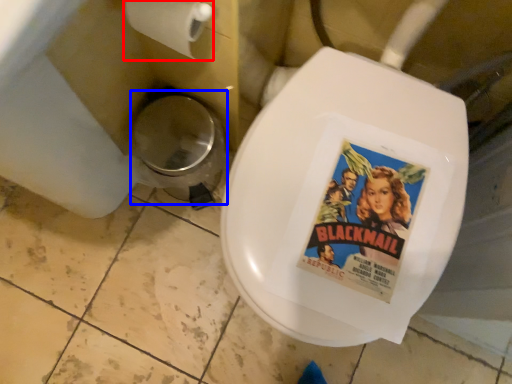
Question: Which of the following is the farthest to the observer, toilet paper (highlighted by a red box) or potty (highlighted by a blue box)?

Choices:
 (A) toilet paper
 (B) potty

Answer: (B)